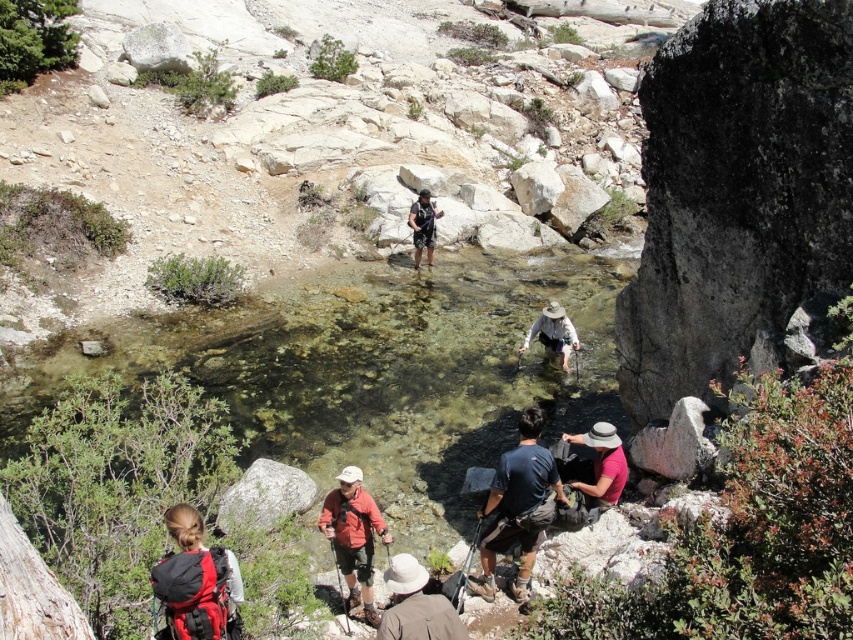
Is red backpack at lower left further to the viewer compared to pink fabric hat at lower center?

No, it is in front of pink fabric hat at lower center.

Which of these two, red backpack at lower left or pink fabric hat at lower center, stands taller?

red backpack at lower left

Is point (180, 506) in front of point (601, 444)?

Yes, point (180, 506) is in front of point (601, 444).

Where is `red backpack at lower left`? The image size is (853, 640). red backpack at lower left is located at coordinates (195, 580).

Does dark blue t-shirt at center appear on the left side of white fabric hat at center?

Correct, you'll find dark blue t-shirt at center to the left of white fabric hat at center.

Which is in front, point (497, 531) or point (577, 346)?

Point (497, 531)

Between point (538, 476) and point (549, 340), which one is positioned behind?

The point (549, 340) is more distant.

Locate an element on the screen. Image resolution: width=853 pixels, height=640 pixels. dark blue t-shirt at center is located at coordinates (518, 508).

How distant is orange fabric backpack at lower center from smooth gray rock at lower left?

They are 4.15 feet apart.

In the scene shown: Between orange fabric backpack at lower center and smooth gray rock at lower left, which one appears on the left side from the viewer's perspective?

smooth gray rock at lower left is more to the left.

I want to click on orange fabric backpack at lower center, so click(352, 536).